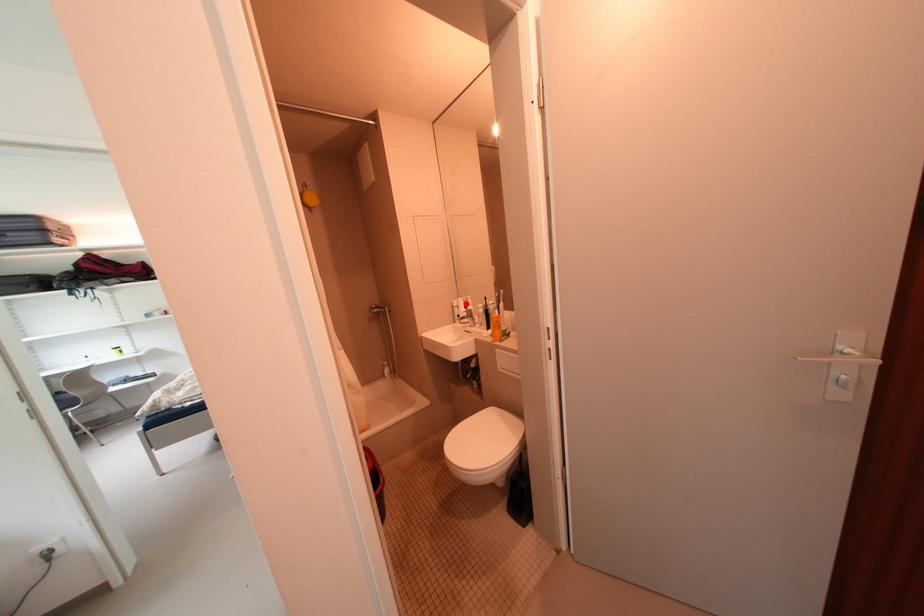
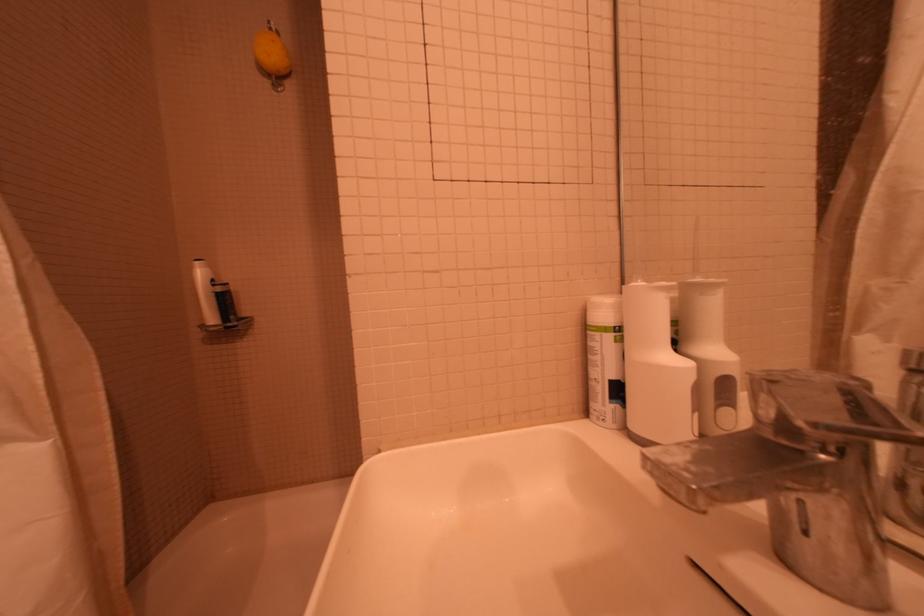
Find the pixel in the second image that matches the highlighted location in the first image.

(627, 309)